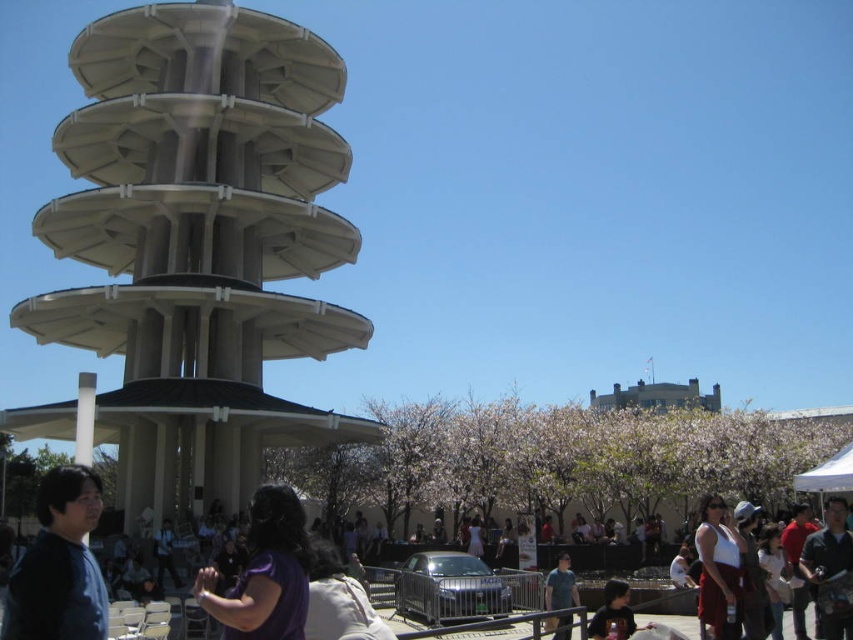
Question: Which of these objects is positioned farthest from the white fabric tank top at center?

Choices:
 (A) white fabric canopy at lower right
 (B) blue denim shirt at center
 (C) matte blue shirt at lower left
 (D) dark blue shirt at center

Answer: (C)

Question: Can you confirm if white concrete tower at center is thinner than white fabric canopy at lower right?

Choices:
 (A) no
 (B) yes

Answer: (A)

Question: Which point appears farthest from the camera in this image?

Choices:
 (A) (845, 625)
 (B) (606, 627)
 (C) (811, 483)

Answer: (C)

Question: Which of the following is the closest to the observer?

Choices:
 (A) (833, 600)
 (B) (96, 486)
 (C) (732, 545)

Answer: (B)

Question: Does purple matte shirt at center appear on the right side of white fabric canopy at lower right?

Choices:
 (A) yes
 (B) no

Answer: (B)

Question: Considering the relative positions of white fabric tank top at center and white fabric canopy at lower right in the image provided, where is white fabric tank top at center located with respect to white fabric canopy at lower right?

Choices:
 (A) right
 (B) left

Answer: (B)